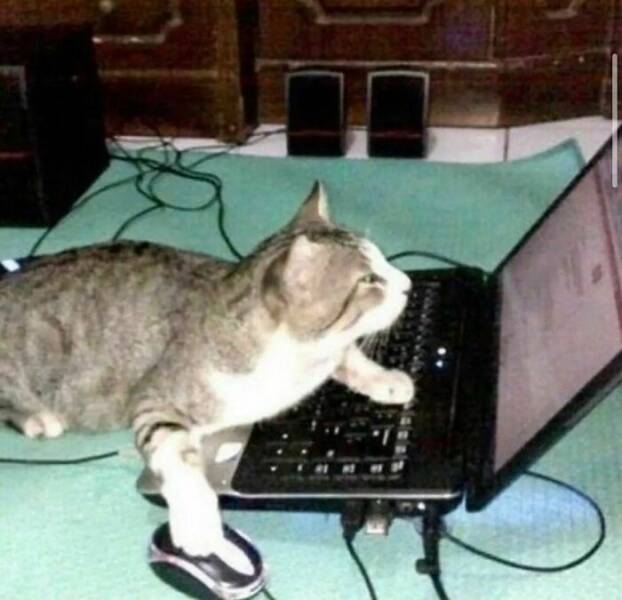
Locate an element on the screen. The height and width of the screenshot is (600, 622). white table is located at coordinates (466, 147).